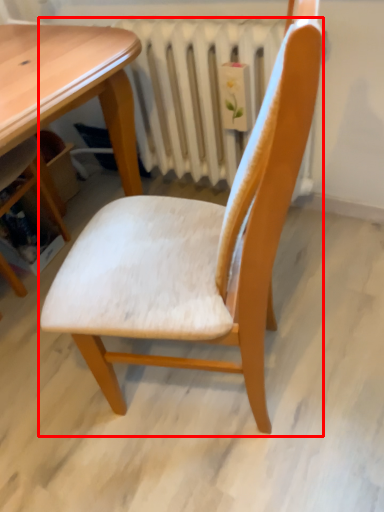
Question: From the image's perspective, where is chair (annotated by the red box) located in relation to radiator in the image?

Choices:
 (A) below
 (B) above

Answer: (A)